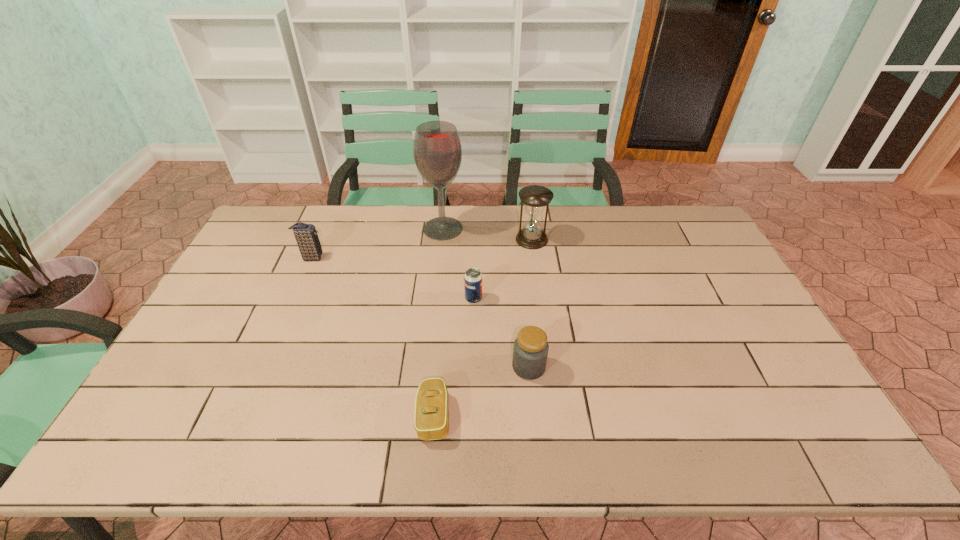
In order to click on vacant space located 0.310m on the left of the hourglass in this screenshot , I will do `click(428, 239)`.

Where is `free space located with the zip open on the taller clutch bag`? The image size is (960, 540). free space located with the zip open on the taller clutch bag is located at coordinates (426, 258).

Image resolution: width=960 pixels, height=540 pixels. In order to click on free space located 0.360m on the surface of the fifth farthest object near the warning symbol in this screenshot , I will do `click(375, 367)`.

At what (x,y) coordinates should I click in order to perform the action: click on vacant region located on the surface of the fifth farthest object near the warning symbol. Please return your answer as a coordinate pair (x, y). This screenshot has width=960, height=540. Looking at the image, I should click on (418, 367).

Identify the location of vacant space located 0.230m on the surface of the fifth farthest object near the warning symbol. This screenshot has width=960, height=540. (425, 367).

Locate an element on the screen. Image resolution: width=960 pixels, height=540 pixels. vacant space located 0.310m on the back of the third nearest object is located at coordinates (474, 232).

Identify the location of vacant region located on the zipper side of the nearest object. (579, 416).

Image resolution: width=960 pixels, height=540 pixels. What are the coordinates of `alcohol that is at the far edge` in the screenshot? It's located at (437, 151).

Identify the location of hourglass present at the far edge. (535, 197).

Where is `object that is positioned at the near edge`? object that is positioned at the near edge is located at coordinates (431, 422).